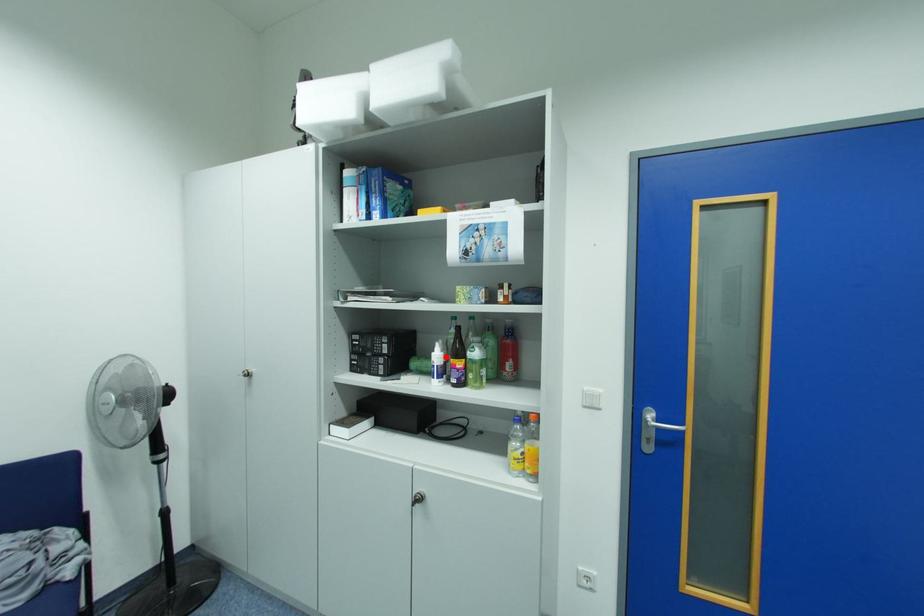
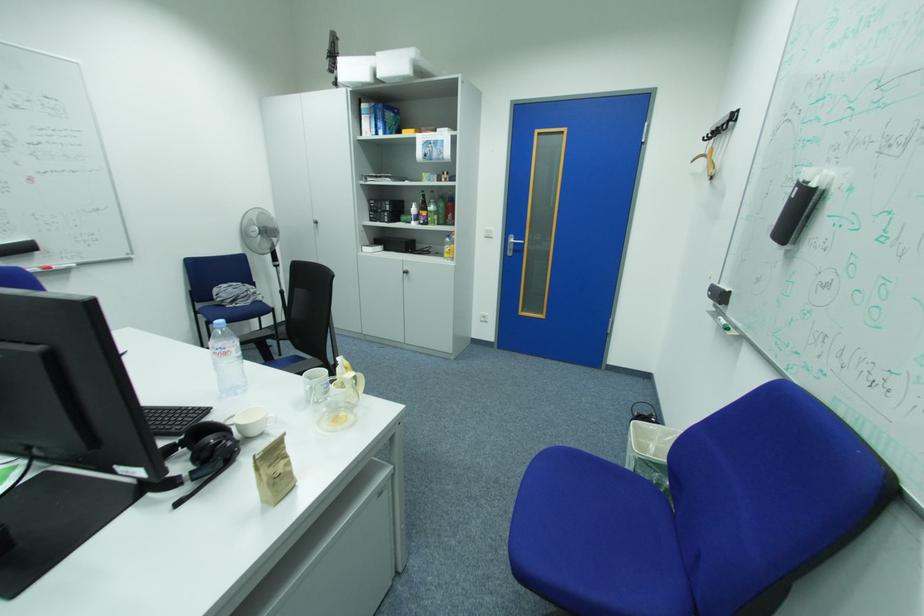
Question: A red point is marked in image1. In image2, is the corresponding 3D point closer to the camera or farther? Reply with the corresponding letter.

Choices:
 (A) The corresponding 3D point is closer.
 (B) The corresponding 3D point is farther.

Answer: (A)